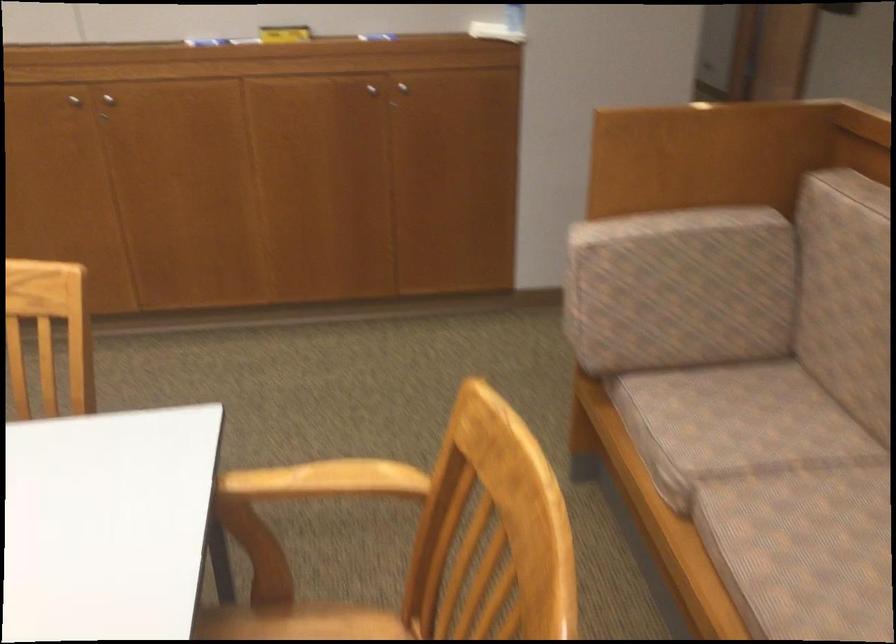
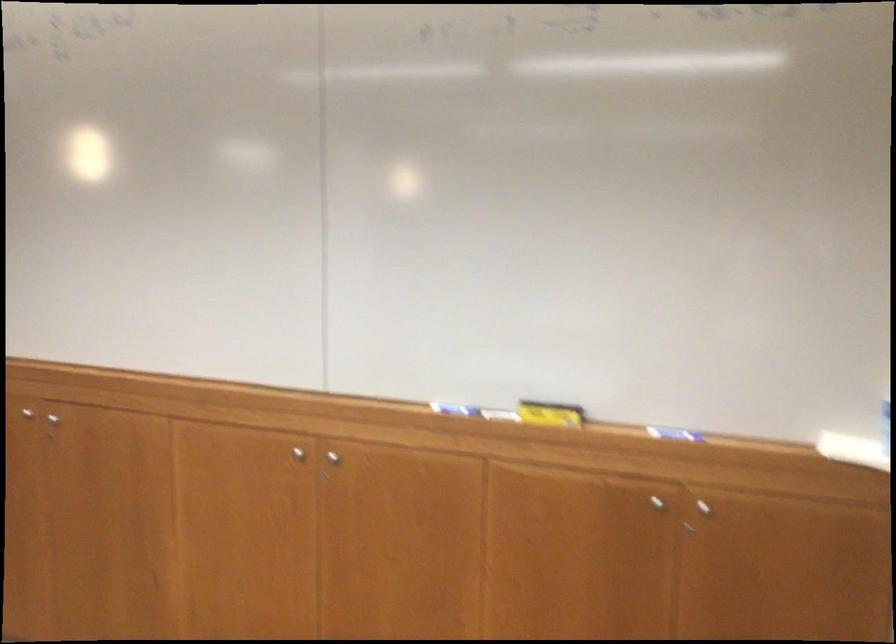
Question: I am providing you with two images of the same scene from different viewpoints. Which of the following objects are not visible in image2?

Choices:
 (A) silver cabinet knob
 (B) whiteboard marker
 (C) yellow whiteboard eraser
 (D) none of these

Answer: (D)